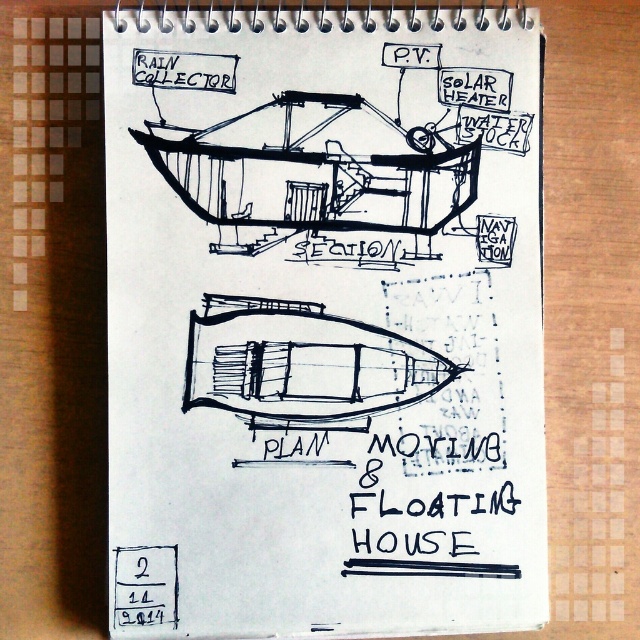
You are an architect reviewing the design of the moving and floating house. You notice the black matte boat at center and the black ink text at lower center in the sketch. Which object takes up more space in the drawing?

The black matte boat at center is bigger than the black ink text at lower center, so it takes up more space in the drawing.

In the scene shown: You are an architect reviewing the concept drawing for the Moving and Floating House. In the section view, you see the black ink drawing at center and the black matte boat at center. Which object is closer to the viewer in this section view?

The black ink drawing at center is closer to the viewer because it is in front of the black matte boat at center in the section view.